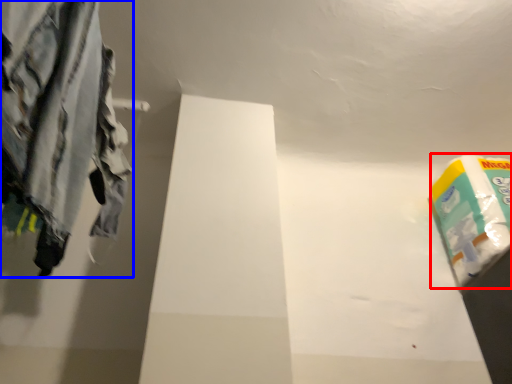
Question: Among these objects, which one is farthest to the camera, toilet paper (highlighted by a red box) or trousers (highlighted by a blue box)?

Choices:
 (A) toilet paper
 (B) trousers

Answer: (A)